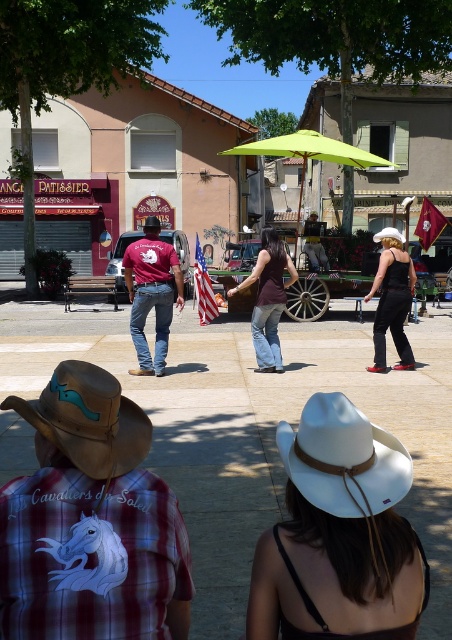
Question: Estimate the real-world distances between objects in this image. Which object is farther from the white felt cowboy hat at center?

Choices:
 (A) matte black jumpsuit at center
 (B) american flag at center

Answer: (B)

Question: Is plaid shirt at center wider than american flag at center?

Choices:
 (A) no
 (B) yes

Answer: (A)

Question: Does brown leather cowboy hat at lower left appear under green fabric umbrella at center?

Choices:
 (A) no
 (B) yes

Answer: (B)

Question: Is green fabric umbrella at center above brown leather cowboy hat at center?

Choices:
 (A) yes
 (B) no

Answer: (A)

Question: Among these points, which one is farthest from the camera?

Choices:
 (A) (133, 554)
 (B) (94, 474)
 (C) (258, 266)

Answer: (C)

Question: Among these objects, which one is nearest to the camera?

Choices:
 (A) straw hat at center
 (B) brown leather cowboy hat at center
 (C) maroon fabric flag at center
 (D) matte purple shirt at center

Answer: (B)